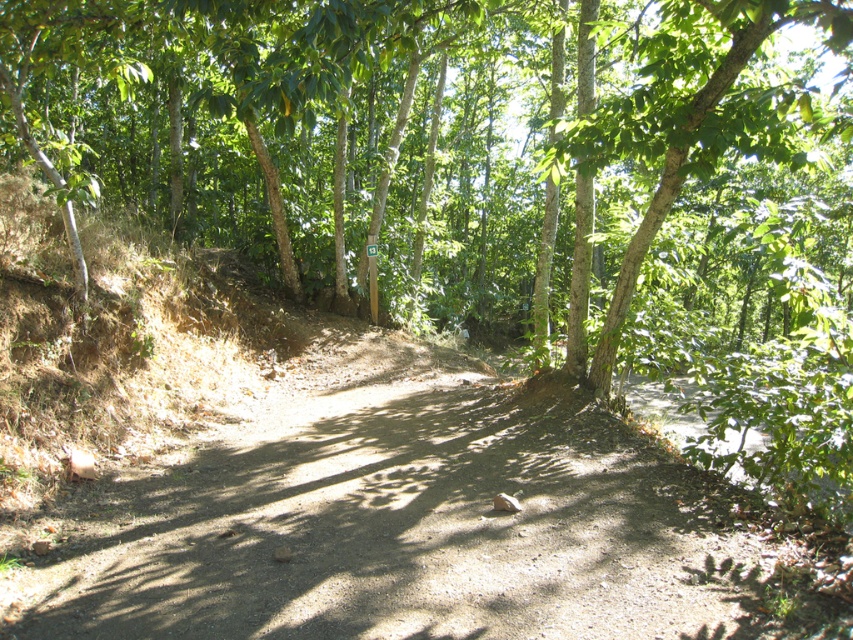
You are a hiker walking along the forest trail and want to know if the brown dirt track at center is visible from behind the green leafy tree at center. Based on the scene description, can you see the track through the tree?

The brown dirt track at center is behind green leafy tree at center, so it would be obstructed by the tree and not visible from that vantage point.

You are a hiker trying to navigate the forest trail. You notice the green leafy tree at center and the brown dirt track at center. Which object is taller?

The green leafy tree at center is much taller than the brown dirt track at center.

Looking at this image, you are standing at the entrance of the forest trail and see the green leafy tree at center. If you walk straight ahead, will you eventually reach the tree?

Yes, because the green leafy tree at center is located along the path you are facing, so walking straight ahead will lead you directly to it.